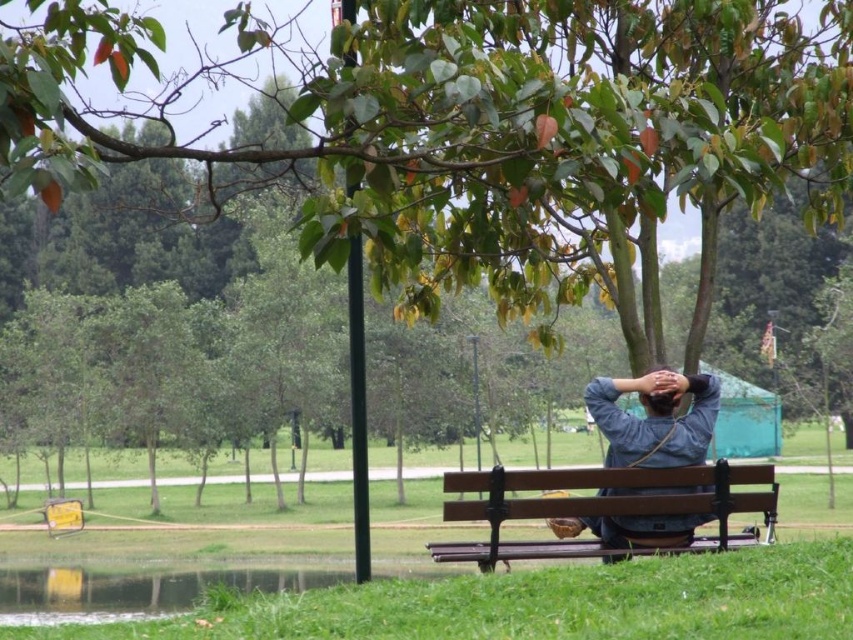
Can you confirm if brown wooden bench at center is wider than green grassy pond at lower left?

No, brown wooden bench at center is not wider than green grassy pond at lower left.

Does point (772, 472) come in front of point (186, 579)?

Yes, point (772, 472) is closer to viewer.

Locate an element on the screen. brown wooden bench at center is located at coordinates (602, 508).

Does green grassy pond at lower left have a greater width compared to brown matte head at center?

Yes.

Does point (42, 596) come in front of point (679, 372)?

No, (42, 596) is behind (679, 372).

Find the location of `green grassy pond at lower left`. green grassy pond at lower left is located at coordinates (136, 589).

Does brown wooden bench at center appear on the left side of brown matte head at center?

Indeed, brown wooden bench at center is positioned on the left side of brown matte head at center.

Measure the distance between point (x=479, y=557) and camera.

Point (x=479, y=557) and camera are 37.64 feet apart.

The height and width of the screenshot is (640, 853). Find the location of `brown wooden bench at center`. brown wooden bench at center is located at coordinates (602, 508).